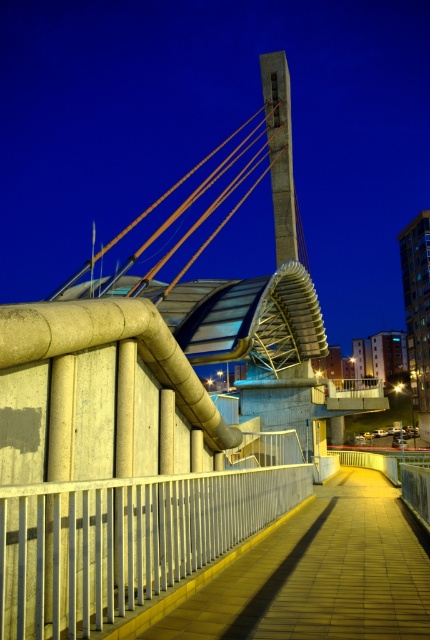
Question: Is silver metallic railing at center further to the viewer compared to yellow concrete path at center?

Choices:
 (A) yes
 (B) no

Answer: (B)

Question: Considering the relative positions of silver metallic railing at center and yellow concrete path at center in the image provided, where is silver metallic railing at center located with respect to yellow concrete path at center?

Choices:
 (A) right
 (B) left

Answer: (B)

Question: Which object is closer to the camera taking this photo?

Choices:
 (A) silver metallic railing at center
 (B) yellow concrete path at center

Answer: (A)

Question: Can you confirm if silver metallic railing at center is positioned below yellow concrete path at center?

Choices:
 (A) no
 (B) yes

Answer: (A)